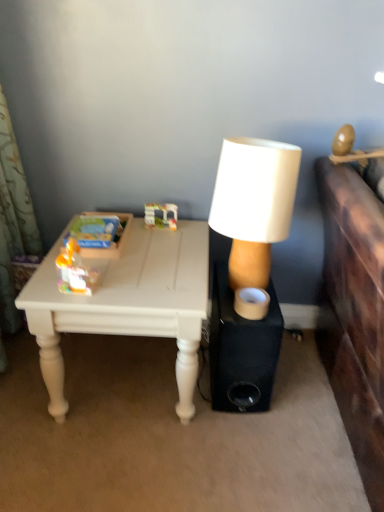
This screenshot has width=384, height=512. Find the location of `free space in front of black matte speaker at center`. free space in front of black matte speaker at center is located at coordinates (238, 440).